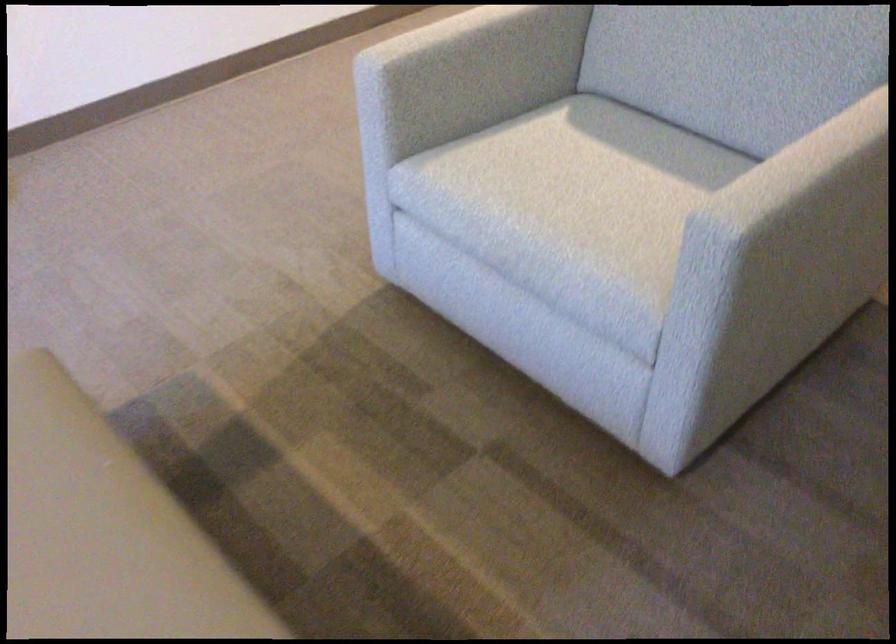
Describe the element at coordinates (607, 169) in the screenshot. I see `the white chair sitting surface` at that location.